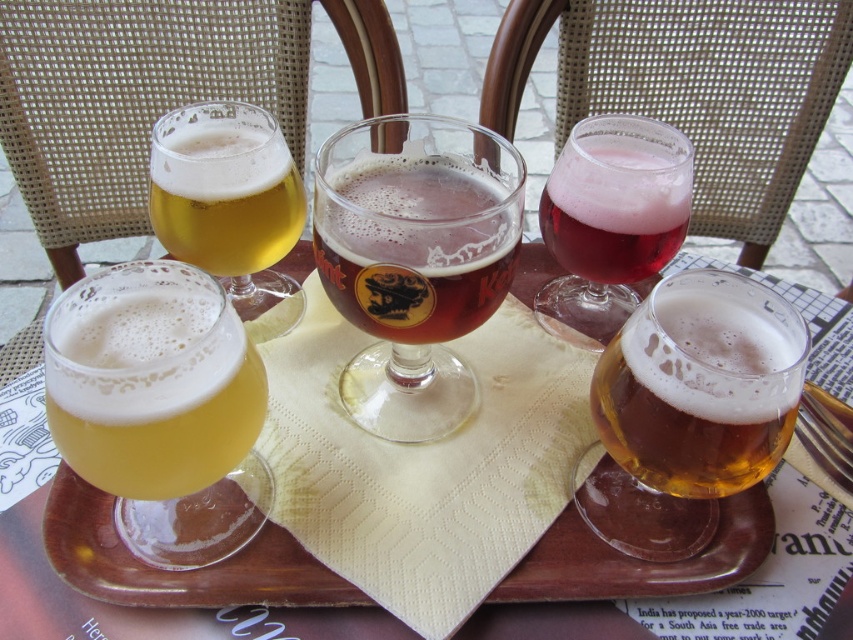
Question: Which of these objects is positioned farthest from the yellow frothy beer at lower left?

Choices:
 (A) golden glass beer at center
 (B) pink frothy beverage at upper right
 (C) translucent glass tray at center
 (D) brown glass beer at center

Answer: (B)

Question: Is translucent glass tray at center to the right of yellow frothy beer at lower left from the viewer's perspective?

Choices:
 (A) yes
 (B) no

Answer: (A)

Question: Can you confirm if translucent glass tray at center is thinner than pink frothy beverage at upper right?

Choices:
 (A) yes
 (B) no

Answer: (B)

Question: Estimate the real-world distances between objects in this image. Which object is farther from the golden glass beer at upper left?

Choices:
 (A) translucent glass tray at center
 (B) yellow frothy beer at lower left
 (C) pink frothy beverage at upper right

Answer: (A)

Question: Can you confirm if translucent glass tray at center is positioned above golden glass beer at center?

Choices:
 (A) yes
 (B) no

Answer: (B)

Question: Which object appears closest to the camera in this image?

Choices:
 (A) translucent glass tray at center
 (B) pink frothy beverage at upper right

Answer: (A)